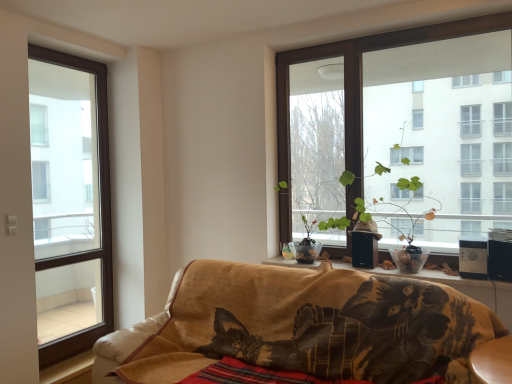
Question: Does brown wooden window at upper right, acting as the 1th window starting from the right, have a smaller size compared to velvet-like brown cat at lower center?

Choices:
 (A) yes
 (B) no

Answer: (A)

Question: Is velvet-like brown cat at lower center at the back of brown wooden window at upper right, acting as the 1th window starting from the right?

Choices:
 (A) yes
 (B) no

Answer: (B)

Question: From the image's perspective, is brown wooden window at upper right, placed as the 2th window when sorted from left to right, on top of velvet-like brown cat at lower center?

Choices:
 (A) yes
 (B) no

Answer: (A)

Question: Is velvet-like brown cat at lower center located within brown wooden window at upper right, acting as the 1th window starting from the right?

Choices:
 (A) yes
 (B) no

Answer: (B)

Question: Can we say brown wooden window at upper right, acting as the 1th window starting from the right, lies outside velvet-like brown cat at lower center?

Choices:
 (A) yes
 (B) no

Answer: (A)

Question: Considering the relative sizes of brown wooden window at upper right, acting as the 1th window starting from the right, and velvet-like brown cat at lower center in the image provided, is brown wooden window at upper right, acting as the 1th window starting from the right, shorter than velvet-like brown cat at lower center?

Choices:
 (A) yes
 (B) no

Answer: (B)

Question: Can you confirm if brown wood window at left, the 2th window from the right, is taller than velvet-like brown cat at lower center?

Choices:
 (A) no
 (B) yes

Answer: (B)

Question: Is brown wood window at left, the 2th window from the right, outside of velvet-like brown cat at lower center?

Choices:
 (A) no
 (B) yes

Answer: (B)

Question: Is brown wood window at left, the 2th window from the right, aimed at velvet-like brown cat at lower center?

Choices:
 (A) yes
 (B) no

Answer: (A)

Question: Can you confirm if brown wood window at left, which ranks as the 1th window in left-to-right order, is positioned to the right of velvet-like brown cat at lower center?

Choices:
 (A) no
 (B) yes

Answer: (A)

Question: From the image's perspective, would you say brown wood window at left, which ranks as the 1th window in left-to-right order, is positioned over velvet-like brown cat at lower center?

Choices:
 (A) yes
 (B) no

Answer: (A)

Question: Considering the relative sizes of brown wood window at left, the 2th window from the right, and velvet-like brown cat at lower center in the image provided, is brown wood window at left, the 2th window from the right, bigger than velvet-like brown cat at lower center?

Choices:
 (A) yes
 (B) no

Answer: (B)

Question: Is the position of brown wooden window at upper right, acting as the 1th window starting from the right, less distant than that of brown wood window at left, the 2th window from the right?

Choices:
 (A) yes
 (B) no

Answer: (A)